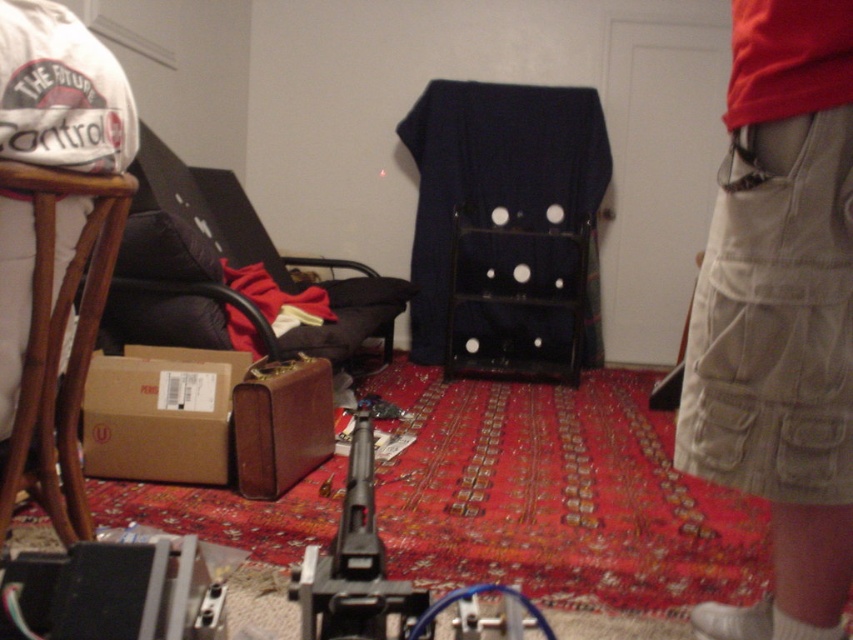
You are a person who is 1.7 meters tall. You want to place a small object on top of the bamboo stool at left and the brown cardboard box at lower left. Which surface will require you to bend down less to reach?

The bamboo stool at left has a greater height compared to brown cardboard box at lower left, so you will need to bend down less when placing the object on the bamboo stool at left.

Based on the photo, you are a security guard in the room. You see the khaki cargo pants at right and the black plastic gun at center. Which object is taller?

The khaki cargo pants at right is taller than the black plastic gun at center.